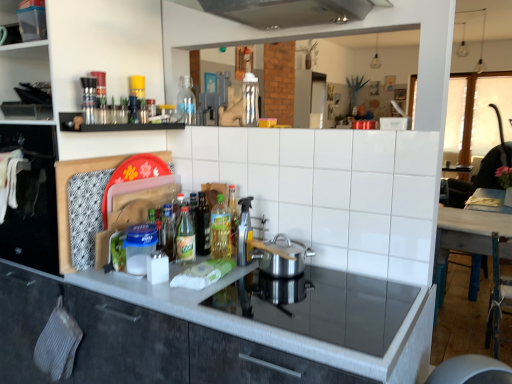
Question: Is clear plastic spray bottle at center inside or outside of matte gray cabinetry at center?

Choices:
 (A) outside
 (B) inside

Answer: (A)

Question: Considering the positions of clear plastic spray bottle at center and matte gray cabinetry at center in the image, is clear plastic spray bottle at center wider or thinner than matte gray cabinetry at center?

Choices:
 (A) wide
 (B) thin

Answer: (B)

Question: Which of these objects is positioned closest to the black matte shelf at upper left, which is counted as the 1th shelf, starting from the bottom?

Choices:
 (A) polished stainless steel pot at center
 (B) white glossy tile at center
 (C) wooden table at right
 (D) matte gray cabinetry at center
 (E) translucent plastic bottle at center, which ranks as the 1th bottle in right-to-left order

Answer: (E)

Question: Estimate the real-world distances between objects in this image. Which object is closer to the wooden table at right?

Choices:
 (A) translucent plastic bottle at center, the 3th bottle when ordered from top to bottom
 (B) matte gray cabinetry at center
 (C) translucent plastic bottle at center, the 4th bottle when ordered from back to front
 (D) translucent glass bottle at center, acting as the 2th bottle starting from the back
 (E) transparent plastic container at upper left, the 1th shelf when ordered from top to bottom

Answer: (A)